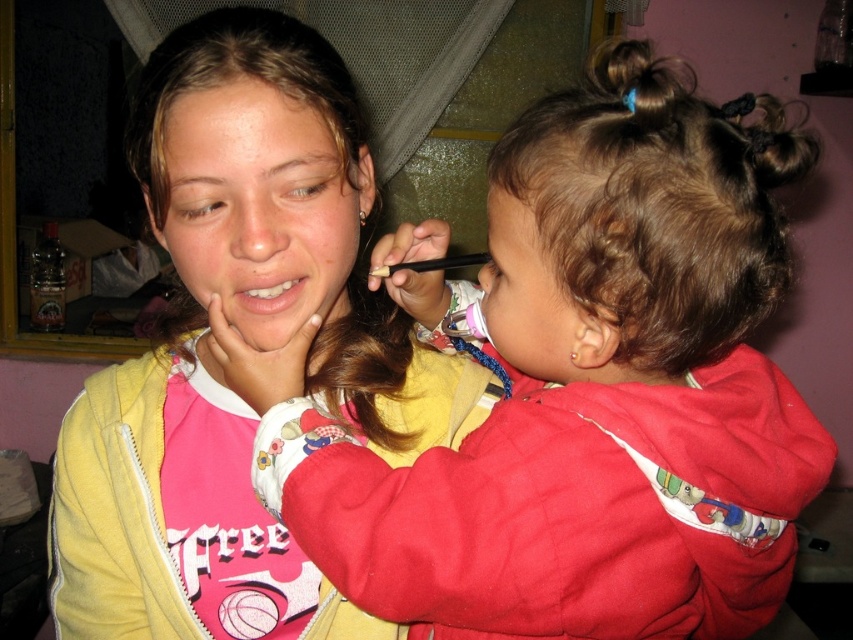
What are the coordinates of the matte skin face at upper center in the image?

The coordinates of the matte skin face at upper center are at point (260, 211).

You are standing in the living room and want to reach the point marked as point [299,292]. If your average step length is 28 inches, how many steps do you need to take to reach that point?

The distance between you and point [299,292] is 22.72 inches. Since your step length is 28 inches, you would need to take approximately 0.81 steps. However, since you can only take whole steps, you would need to take 1 step to reach the point.